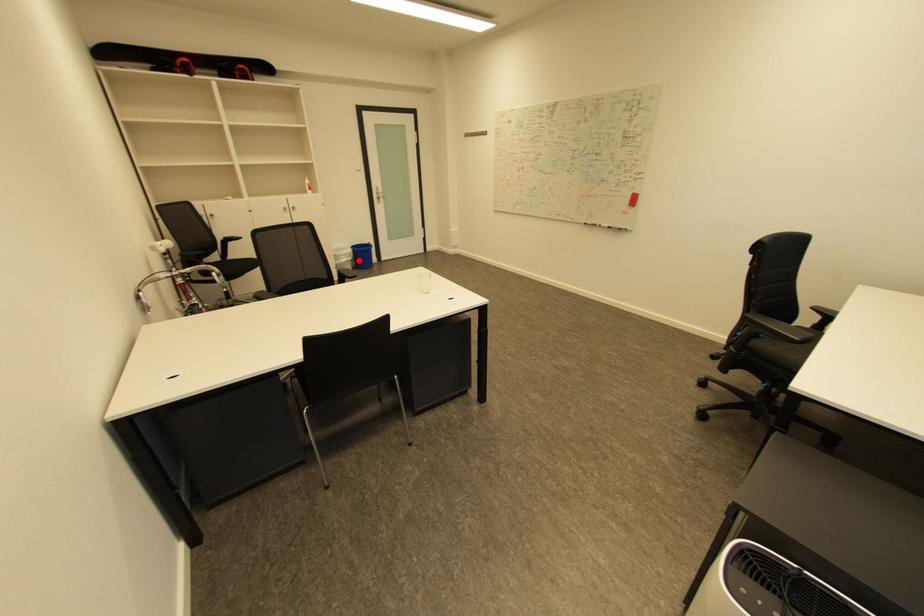
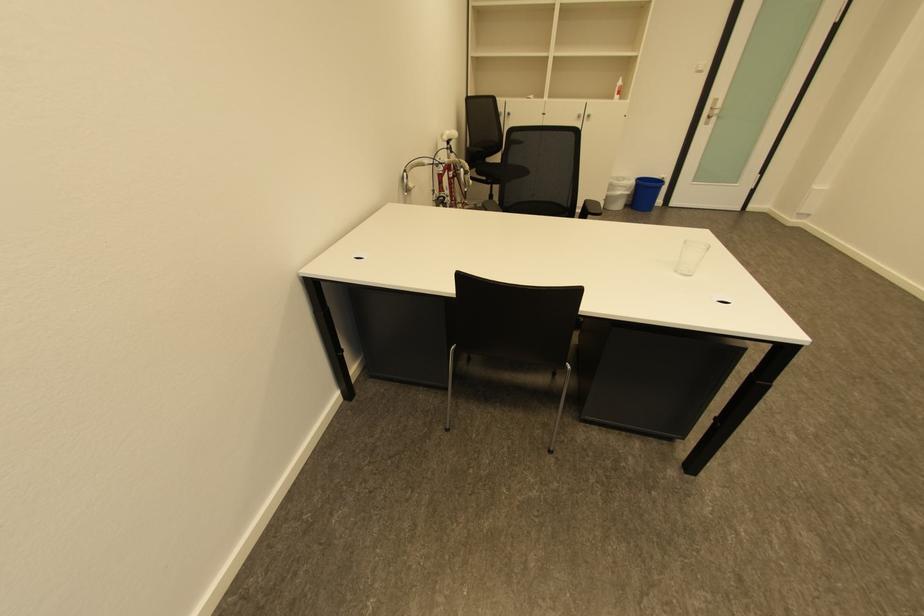
Find the pixel in the second image that matches the highlighted location in the first image.

(635, 196)